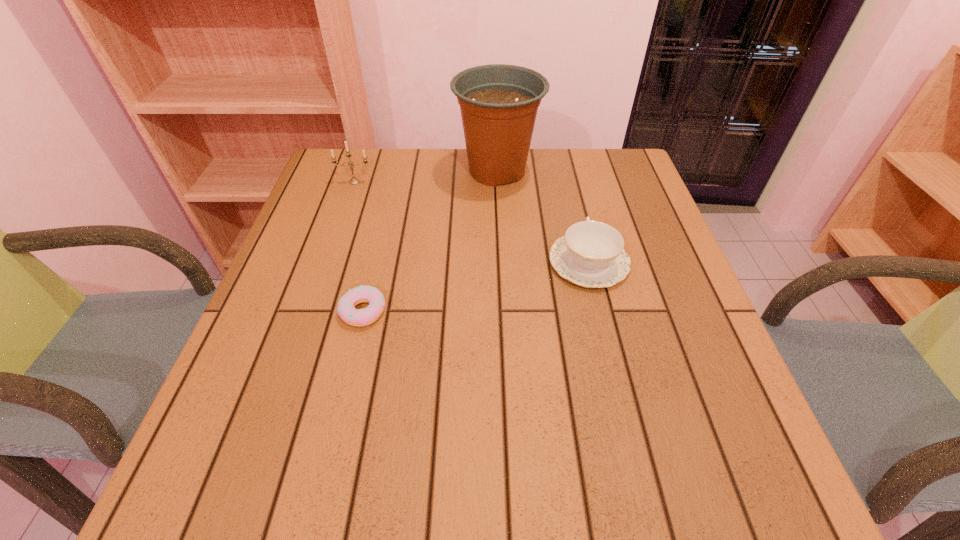
Where is `vacant area situated 0.400m on the handle side of the second shortest object`? vacant area situated 0.400m on the handle side of the second shortest object is located at coordinates (562, 150).

Identify the location of vacant space situated on the handle side of the second shortest object. The image size is (960, 540). (567, 176).

Locate an element on the screen. vacant space located on the right of the doughnut is located at coordinates point(559,311).

Identify the location of flowerpot present at the far edge. The height and width of the screenshot is (540, 960). (498, 102).

Where is `candle that is at the far edge`? This screenshot has height=540, width=960. candle that is at the far edge is located at coordinates (354, 181).

Find the location of `candle at the left edge`. candle at the left edge is located at coordinates (354, 181).

Where is `doughnut present at the left edge`? The image size is (960, 540). doughnut present at the left edge is located at coordinates (346, 310).

This screenshot has height=540, width=960. In order to click on object positioned at the right edge in this screenshot , I will do `click(590, 254)`.

Where is `object positioned at the far left corner`? Image resolution: width=960 pixels, height=540 pixels. object positioned at the far left corner is located at coordinates (354, 181).

The width and height of the screenshot is (960, 540). I want to click on vacant space at the far edge of the desktop, so click(x=381, y=172).